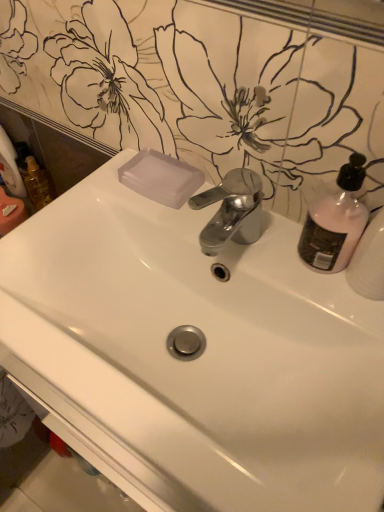
At what (x,y) coordinates should I click in order to perform the action: click on vacant space situated on the left part of pink matte bottle at upper right. Please return your answer as a coordinate pair (x, y). Looking at the image, I should click on (246, 244).